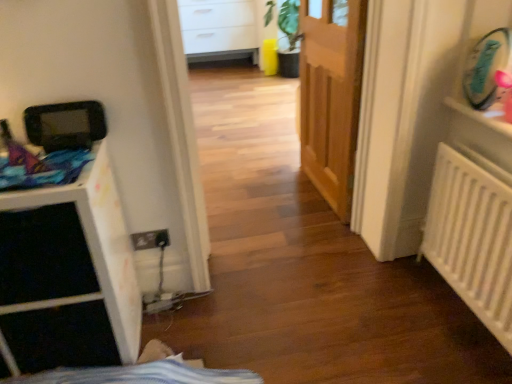
The width and height of the screenshot is (512, 384). In order to click on vacant space underneath wooden door at center (from a real-world perspective) in this screenshot , I will do `click(318, 196)`.